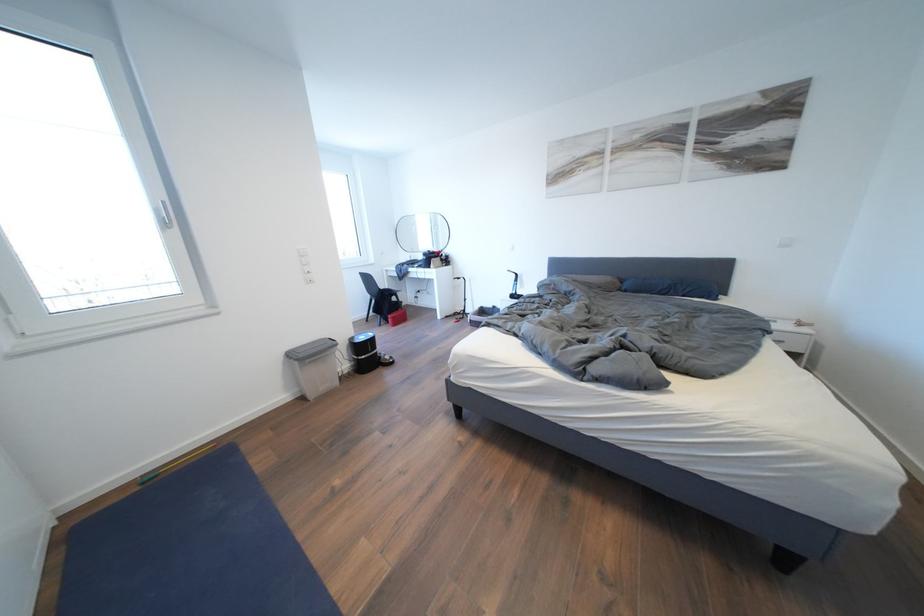
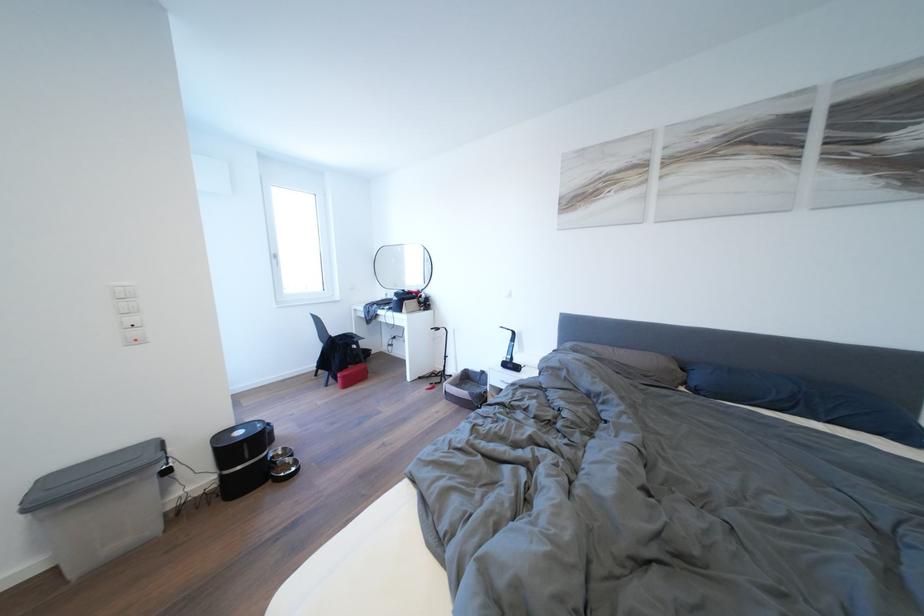
Find the pixel in the second image that matches (633,296) in the first image.

(703, 395)